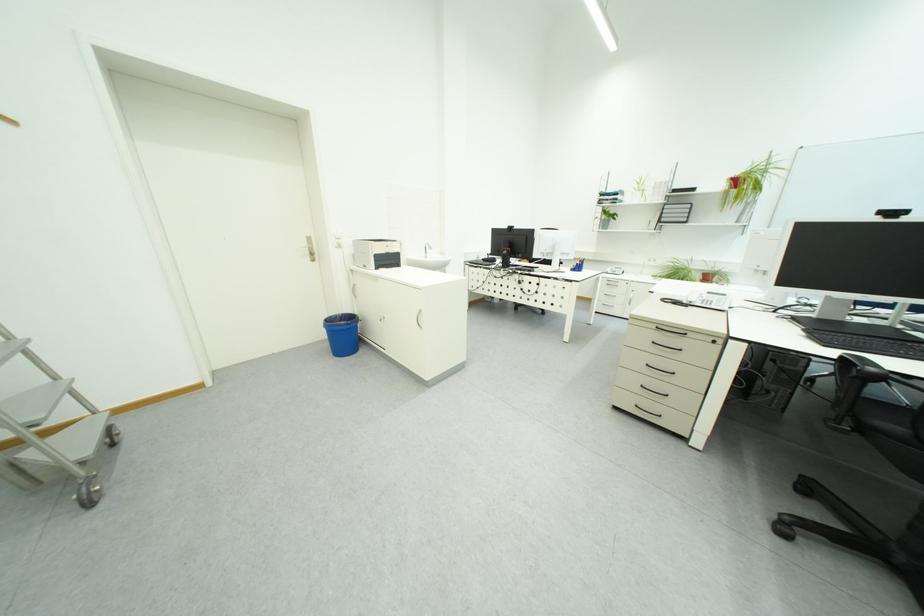
Where would you pull the white cabinet handle? Please return your answer as a coordinate pair (x, y).

(419, 318)